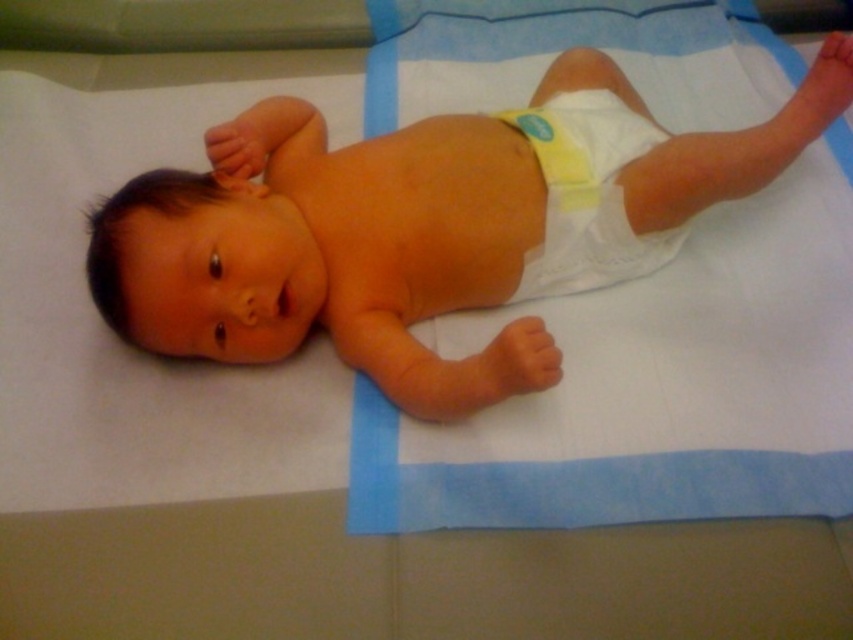
From the picture: You are a healthcare professional checking the baby on the changing table. You need to ensure the diaper fits properly. Based on the image, will the white cloth diaper at center be large enough for the smooth skin baby at center?

The smooth skin baby at center is larger in size than the white cloth diaper at center, so the diaper may not be large enough to properly fit the baby.

You are a nurse in a hospital nursery. You need to check if the smooth skin baby at center is properly positioned on the white cloth diaper at center. Based on the image, is the baby entirely on top of the diaper?

The smooth skin baby at center is in front of white cloth diaper at center, so the baby is positioned in front of the diaper, not entirely on top of it. Adjust the baby to ensure full coverage.

Where is the smooth skin baby at center located in the image?

The smooth skin baby at center is located at point 0.355 on the x axis and 0.502 on the y axis.